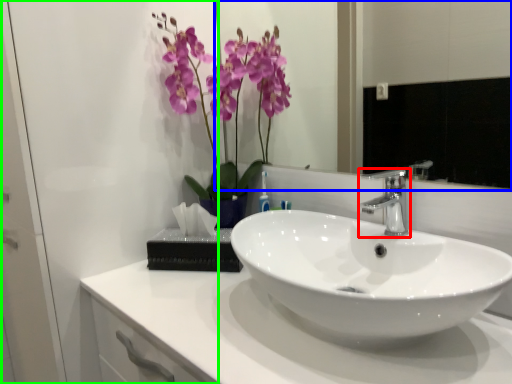
Question: Estimate the real-world distances between objects in this image. Which object is farther from tap (highlighted by a red box), mirror (highlighted by a blue box) or glass door (highlighted by a green box)?

Choices:
 (A) mirror
 (B) glass door

Answer: (A)